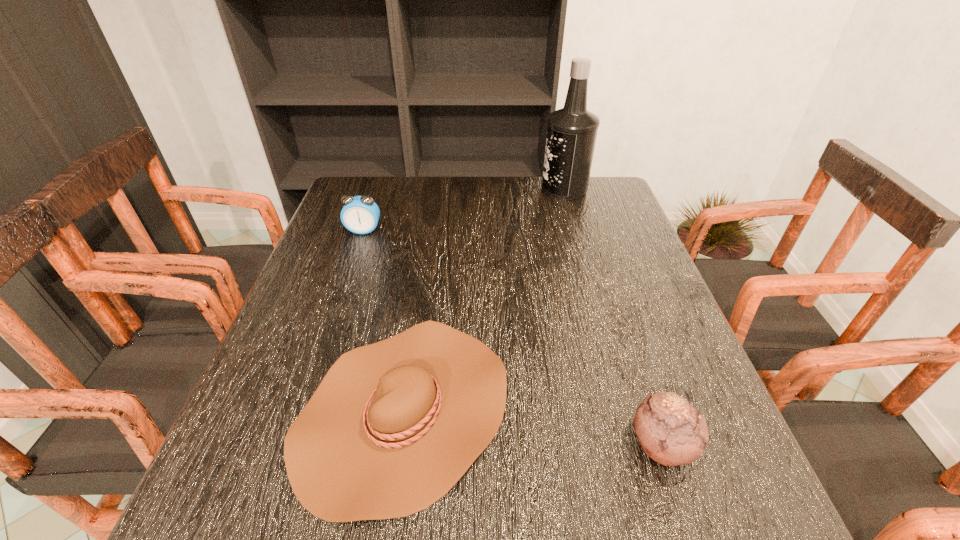
Identify the location of free space that satisfies the following two spatial constraints: 1. on the face of the cowboy hat; 2. on the right side of the alarm clock. Image resolution: width=960 pixels, height=540 pixels. (301, 410).

Where is `free space that satisfies the following two spatial constraints: 1. on the face of the alarm clock; 2. on the right side of the muffin`? The width and height of the screenshot is (960, 540). free space that satisfies the following two spatial constraints: 1. on the face of the alarm clock; 2. on the right side of the muffin is located at coordinates (290, 444).

Where is `free space in the image that satisfies the following two spatial constraints: 1. on the face of the cowboy hat; 2. on the right side of the alarm clock`? Image resolution: width=960 pixels, height=540 pixels. free space in the image that satisfies the following two spatial constraints: 1. on the face of the cowboy hat; 2. on the right side of the alarm clock is located at coordinates (301, 410).

You are a GUI agent. You are given a task and a screenshot of the screen. Output one action in this format:
    pyautogui.click(x=<x>, y=<y>)
    Task: Click on the vacant space that satisfies the following two spatial constraints: 1. on the front label of the farthest object; 2. on the face of the alarm clock
    This screenshot has width=960, height=540.
    Given the screenshot: What is the action you would take?
    pyautogui.click(x=576, y=231)

This screenshot has height=540, width=960. What are the coordinates of `vacant area in the image that satisfies the following two spatial constraints: 1. on the face of the alarm clock; 2. on the left side of the muffin` in the screenshot? It's located at (290, 444).

Locate an element on the screen. vacant space that satisfies the following two spatial constraints: 1. on the front label of the muffin; 2. on the left side of the tallest object is located at coordinates (637, 444).